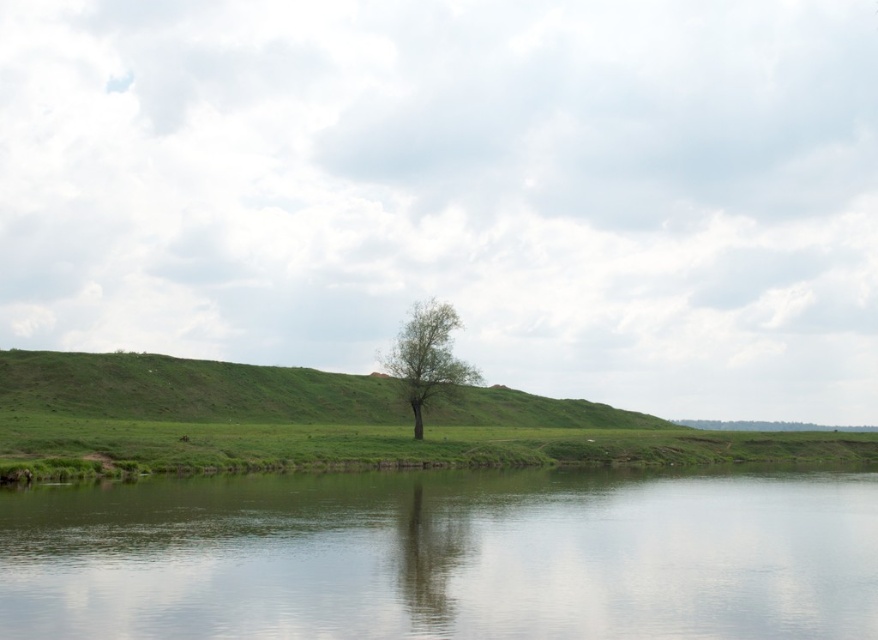
Question: Does green smooth water at center appear over green leafy tree at center?

Choices:
 (A) yes
 (B) no

Answer: (B)

Question: Can you confirm if green smooth water at center is thinner than green leafy tree at center?

Choices:
 (A) yes
 (B) no

Answer: (B)

Question: Which point is closer to the camera taking this photo?

Choices:
 (A) (366, 520)
 (B) (399, 337)

Answer: (A)

Question: Which point is farther to the camera?

Choices:
 (A) green smooth water at center
 (B) green leafy tree at center

Answer: (B)

Question: Can you confirm if green smooth water at center is positioned to the right of green leafy tree at center?

Choices:
 (A) no
 (B) yes

Answer: (B)